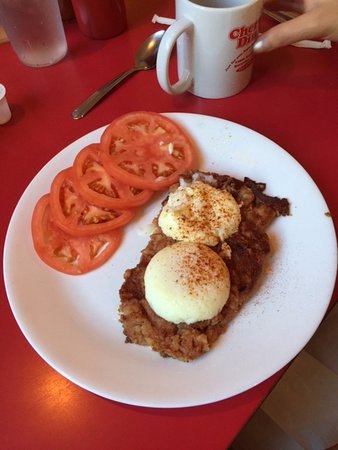
The image size is (338, 450). I want to click on mug, so click(x=205, y=61).